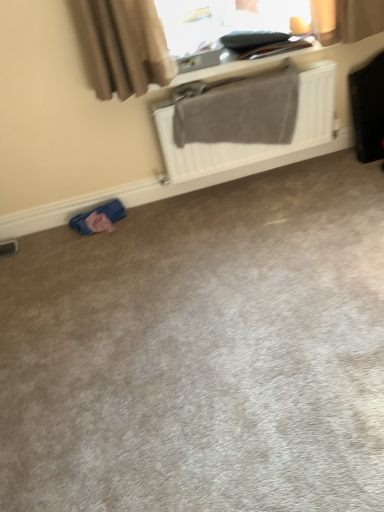
Question: Is blue fabric at lower left directly adjacent to gray carpet at lower left?

Choices:
 (A) yes
 (B) no

Answer: (B)

Question: Does blue fabric at lower left have a greater width compared to gray carpet at lower left?

Choices:
 (A) no
 (B) yes

Answer: (A)

Question: Considering the relative sizes of blue fabric at lower left and gray carpet at lower left in the image provided, is blue fabric at lower left taller than gray carpet at lower left?

Choices:
 (A) yes
 (B) no

Answer: (A)

Question: Is blue fabric at lower left located outside gray carpet at lower left?

Choices:
 (A) yes
 (B) no

Answer: (A)

Question: Is gray carpet at lower left at the back of blue fabric at lower left?

Choices:
 (A) no
 (B) yes

Answer: (A)

Question: Is blue fabric at lower left bigger than gray carpet at lower left?

Choices:
 (A) yes
 (B) no

Answer: (B)

Question: Is black leather suitcase at right touching gray carpet at lower left?

Choices:
 (A) no
 (B) yes

Answer: (A)

Question: From a real-world perspective, is black leather suitcase at right under gray carpet at lower left?

Choices:
 (A) no
 (B) yes

Answer: (A)

Question: Is black leather suitcase at right positioned in front of gray carpet at lower left?

Choices:
 (A) yes
 (B) no

Answer: (B)

Question: Does black leather suitcase at right have a smaller size compared to gray carpet at lower left?

Choices:
 (A) yes
 (B) no

Answer: (A)

Question: Is black leather suitcase at right to the left of gray carpet at lower left from the viewer's perspective?

Choices:
 (A) yes
 (B) no

Answer: (B)

Question: Is black leather suitcase at right turned away from gray carpet at lower left?

Choices:
 (A) no
 (B) yes

Answer: (A)

Question: Considering the relative positions of blue fabric at lower left and white matte radiator at upper center in the image provided, is blue fabric at lower left behind white matte radiator at upper center?

Choices:
 (A) yes
 (B) no

Answer: (A)